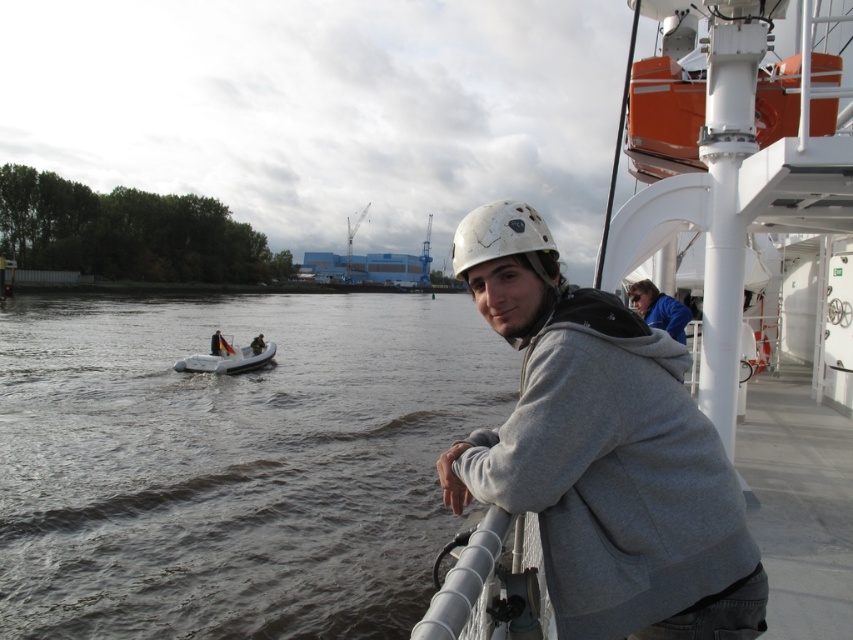
Question: Can you confirm if gray matte jacket at center is bigger than white rubber boat at center?

Choices:
 (A) no
 (B) yes

Answer: (A)

Question: Does white rubber boat at center come behind dark gray rubber boat at center-left?

Choices:
 (A) no
 (B) yes

Answer: (A)

Question: Can you confirm if white matte helmet at upper center is bigger than dark gray rubber boat at center-left?

Choices:
 (A) yes
 (B) no

Answer: (A)

Question: Which point is farther to the camera?

Choices:
 (A) dark gray water at center
 (B) white matte helmet at upper center
 (C) gray matte jacket at center
 (D) dark gray rubber boat at center-left

Answer: (D)

Question: Which point is closer to the camera?

Choices:
 (A) dark gray rubber boat at center-left
 (B) white matte helmet at upper center
 (C) dark gray water at center
 (D) white rubber boat at center

Answer: (B)

Question: Which point is closer to the camera?

Choices:
 (A) (480, 257)
 (B) (271, 358)
 (C) (154, 512)

Answer: (A)